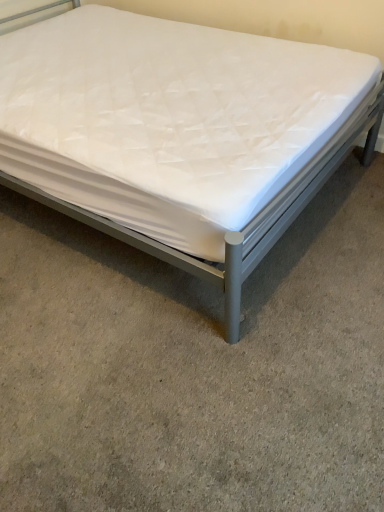
The width and height of the screenshot is (384, 512). In order to click on free space above white quilted mattress at center (from a real-world perspective) in this screenshot , I will do `click(190, 304)`.